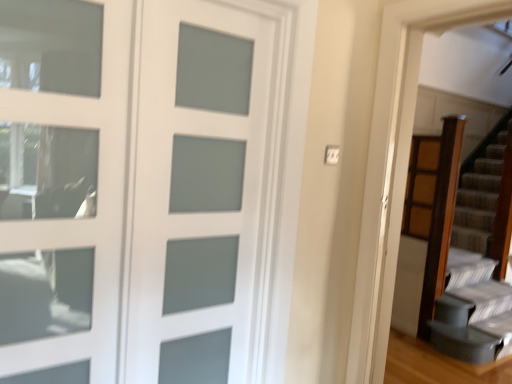
What do you see at coordinates (62, 187) in the screenshot? I see `satin glass door at upper left` at bounding box center [62, 187].

Locate an element on the screen. satin glass door at upper left is located at coordinates (62, 187).

Describe the element at coordinates (139, 196) in the screenshot. This screenshot has width=512, height=384. I see `white frosted glass door at center` at that location.

Find the location of `white frosted glass door at center`. white frosted glass door at center is located at coordinates (139, 196).

You are a GUI agent. You are given a task and a screenshot of the screen. Output one action in this format:
    pyautogui.click(x=<x>, y=<y>)
    Task: Click on the satin glass door at upper left
    The image size is (512, 384).
    Given the screenshot: What is the action you would take?
    pyautogui.click(x=62, y=187)

Which object is positioned more to the right, satin glass door at upper left or white frosted glass door at center?

Positioned to the right is white frosted glass door at center.

Between satin glass door at upper left and white frosted glass door at center, which one is positioned in front?

satin glass door at upper left is closer to the camera.

Is point (51, 73) closer or farther from the camera than point (104, 121)?

Point (51, 73) is closer to the camera than point (104, 121).

From the image's perspective, is satin glass door at upper left beneath white frosted glass door at center?

Incorrect, from the image's perspective, satin glass door at upper left is higher than white frosted glass door at center.

From a real-world perspective, between satin glass door at upper left and white frosted glass door at center, who is vertically lower?

white frosted glass door at center, from a real-world perspective.

Which object is thinner, satin glass door at upper left or white frosted glass door at center?

satin glass door at upper left.

Looking at this image, between satin glass door at upper left and white frosted glass door at center, which one has less height?

Standing shorter between the two is satin glass door at upper left.

Which of these two, satin glass door at upper left or white frosted glass door at center, is smaller?

Smaller between the two is satin glass door at upper left.

In the scene shown: Is satin glass door at upper left not within white frosted glass door at center?

Indeed, satin glass door at upper left is completely outside white frosted glass door at center.

Is satin glass door at upper left directly adjacent to white frosted glass door at center?

They are not placed beside each other.

Could you tell me if satin glass door at upper left is facing white frosted glass door at center?

No, satin glass door at upper left does not turn towards white frosted glass door at center.

Measure the distance between satin glass door at upper left and white frosted glass door at center.

satin glass door at upper left and white frosted glass door at center are 6.33 inches apart.

Locate an element on the screen. screen door above the white frosted glass door at center (from the image's perspective) is located at coordinates click(x=62, y=187).

Does white frosted glass door at center appear on the right side of satin glass door at upper left?

Yes.

Is white frosted glass door at center positioned before satin glass door at upper left?

No, it is behind satin glass door at upper left.

Considering the points (192, 58) and (109, 291), which point is behind, point (192, 58) or point (109, 291)?

The point (192, 58) is farther.

From the image's perspective, does white frosted glass door at center appear lower than satin glass door at upper left?

Correct, white frosted glass door at center appears lower than satin glass door at upper left in the image.

From a real-world perspective, is white frosted glass door at center positioned over satin glass door at upper left based on gravity?

No.

Does white frosted glass door at center have a lesser width compared to satin glass door at upper left?

No.

Considering the relative sizes of white frosted glass door at center and satin glass door at upper left in the image provided, is white frosted glass door at center shorter than satin glass door at upper left?

No.

Who is bigger, white frosted glass door at center or satin glass door at upper left?

Bigger between the two is white frosted glass door at center.

Would you say white frosted glass door at center is outside satin glass door at upper left?

white frosted glass door at center is positioned outside satin glass door at upper left.

Can you see white frosted glass door at center touching satin glass door at upper left?

No, white frosted glass door at center is not next to satin glass door at upper left.

From the picture: Does white frosted glass door at center turn towards satin glass door at upper left?

No, white frosted glass door at center is not oriented towards satin glass door at upper left.

What's the angular difference between white frosted glass door at center and satin glass door at upper left's facing directions?

They differ by 0.00215 degrees in their facing directions.

Where is `screen door located above the white frosted glass door at center (from a real-world perspective)`? The width and height of the screenshot is (512, 384). screen door located above the white frosted glass door at center (from a real-world perspective) is located at coordinates (62, 187).

At what (x,y) coordinates should I click in order to perform the action: click on screen door in front of the white frosted glass door at center. Please return your answer as a coordinate pair (x, y). The width and height of the screenshot is (512, 384). Looking at the image, I should click on (62, 187).

In the image, there is a satin glass door at upper left. Identify the location of door below it (from the image's perspective). (139, 196).